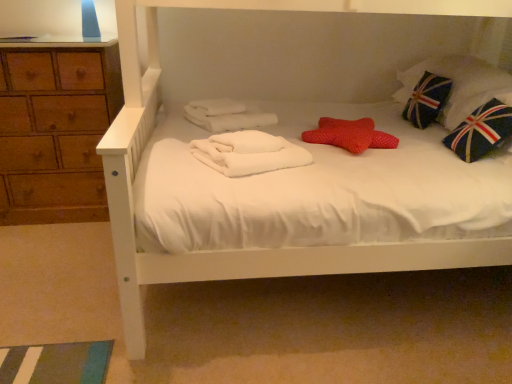
Question: Can you confirm if union jack fabric pillow at upper right, which is counted as the second pillow, starting from the left, is positioned to the right of red dotted pillow at center, arranged as the 1th pillow when viewed from the left?

Choices:
 (A) yes
 (B) no

Answer: (A)

Question: From a real-world perspective, does union jack fabric pillow at upper right, acting as the 2th pillow starting from the front, stand above red dotted pillow at center, which is the 2th pillow in back-to-front order?

Choices:
 (A) yes
 (B) no

Answer: (A)

Question: Would you say union jack fabric pillow at upper right, positioned as the 2th pillow in bottom-to-top order, is a long distance from red dotted pillow at center, which is counted as the 1th pillow, starting from the front?

Choices:
 (A) yes
 (B) no

Answer: (B)

Question: Is union jack fabric pillow at upper right, placed as the first pillow when sorted from top to bottom, shorter than red dotted pillow at center, which is counted as the 1th pillow, starting from the front?

Choices:
 (A) yes
 (B) no

Answer: (B)

Question: Is union jack fabric pillow at upper right, the first pillow from the back, positioned behind red dotted pillow at center, acting as the second pillow starting from the right?

Choices:
 (A) yes
 (B) no

Answer: (A)

Question: Is union jack fabric pillow at upper right, acting as the 2th pillow starting from the front, bigger than red dotted pillow at center, acting as the second pillow starting from the right?

Choices:
 (A) yes
 (B) no

Answer: (A)

Question: Can you confirm if union jack fabric pillow at upper right, placed as the first pillow when sorted from top to bottom, is smaller than white soft towel at center?

Choices:
 (A) yes
 (B) no

Answer: (B)

Question: Can you confirm if union jack fabric pillow at upper right, positioned as the 2th pillow in bottom-to-top order, is thinner than white soft towel at center?

Choices:
 (A) no
 (B) yes

Answer: (A)

Question: From the image's perspective, is union jack fabric pillow at upper right, placed as the first pillow when sorted from top to bottom, located above white soft towel at center?

Choices:
 (A) yes
 (B) no

Answer: (A)

Question: Is union jack fabric pillow at upper right, which is counted as the second pillow, starting from the left, taller than white soft towel at center?

Choices:
 (A) no
 (B) yes

Answer: (B)

Question: Is white soft towel at center completely or partially inside union jack fabric pillow at upper right, acting as the 2th pillow starting from the front?

Choices:
 (A) no
 (B) yes

Answer: (A)

Question: Does union jack fabric pillow at upper right, placed as the first pillow when sorted from top to bottom, touch white soft towel at center?

Choices:
 (A) yes
 (B) no

Answer: (B)

Question: Does union jack fabric pillow at upper right, the first pillow from the back, have a greater height compared to blue fabric pillow with union jack design at right?

Choices:
 (A) no
 (B) yes

Answer: (B)